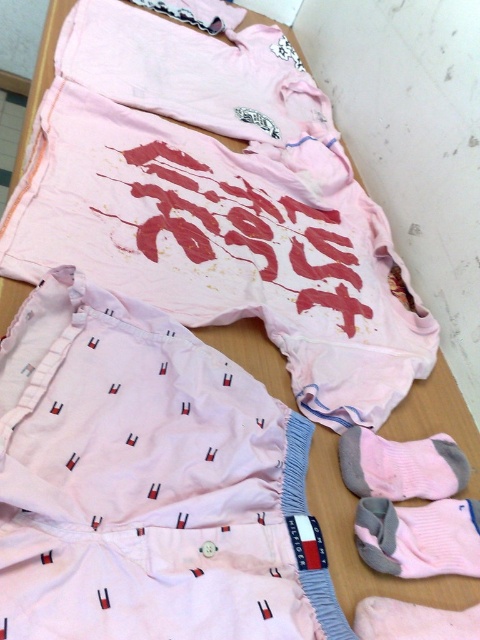
Question: Is the position of pink cotton shorts at lower left less distant than that of pink cotton sock at lower right?

Choices:
 (A) no
 (B) yes

Answer: (A)

Question: Among these points, which one is farthest from the camera?

Choices:
 (A) (356, 496)
 (B) (456, 618)

Answer: (A)

Question: Estimate the real-world distances between objects in this image. Which object is closer to the pink cotton sock at lower right?

Choices:
 (A) pink cotton shorts at center
 (B) gray cotton sock at lower right
 (C) pink knitted sock at lower right
 (D) pink cotton shorts at lower left

Answer: (C)

Question: Which object is closer to the camera taking this photo?

Choices:
 (A) pink cotton shorts at center
 (B) pink cotton shorts at lower left

Answer: (A)

Question: Can you confirm if pink cotton shorts at lower left is positioned to the left of pink cotton sock at lower right?

Choices:
 (A) yes
 (B) no

Answer: (A)

Question: Is gray cotton sock at lower right to the right of pink cotton sock at lower right from the viewer's perspective?

Choices:
 (A) yes
 (B) no

Answer: (A)